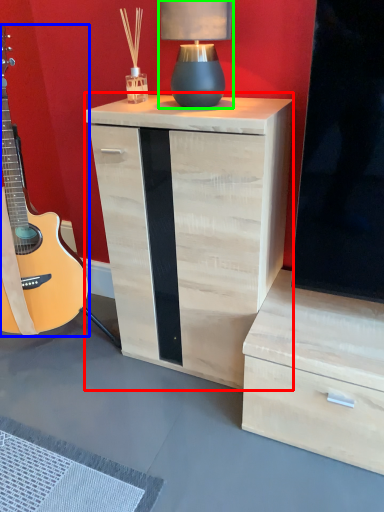
Question: Considering the real-world distances, which object is closest to nightstand (highlighted by a red box)? guitar (highlighted by a blue box) or table lamp (highlighted by a green box).

Choices:
 (A) guitar
 (B) table lamp

Answer: (B)